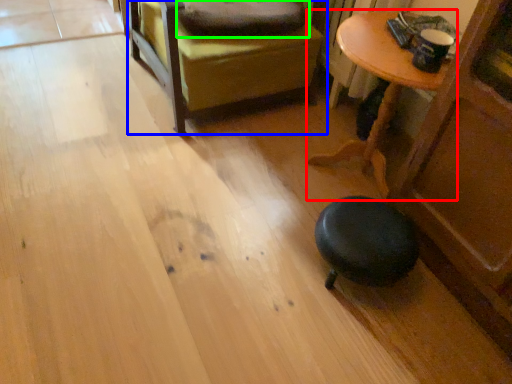
Question: Considering the real-world distances, which object is farthest from table (highlighted by a red box)? furniture (highlighted by a blue box) or pillow (highlighted by a green box)?

Choices:
 (A) furniture
 (B) pillow

Answer: (B)